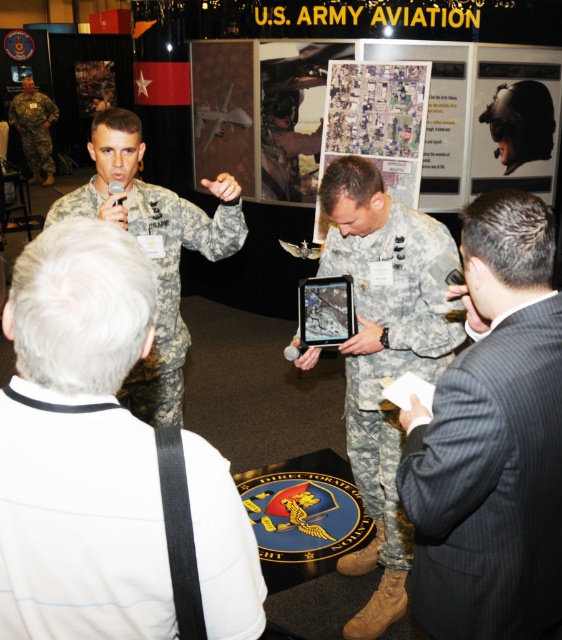
You are an event organizer at the U.S. Army Aviation exhibition. You need to arrange chairs for a presentation. The camouflage fabric uniform at center and the camouflage fabric uniform at left are standing in the front row. Which individual has a narrower width so you can place a smaller chair for them?

The camouflage fabric uniform at center has a lesser width compared to camouflage fabric uniform at left, so you should place a smaller chair for the camouflage fabric uniform at center.